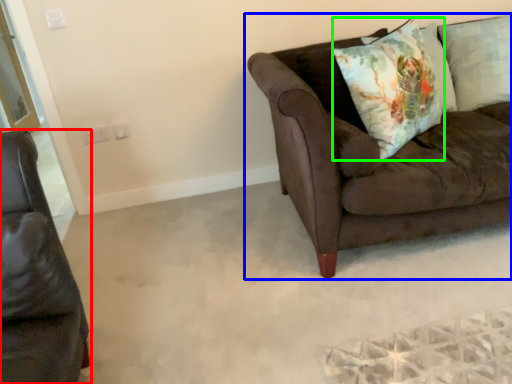
Question: Estimate the real-world distances between objects in this image. Which object is closer to studio couch (highlighted by a red box), studio couch (highlighted by a blue box) or throw pillow (highlighted by a green box)?

Choices:
 (A) studio couch
 (B) throw pillow

Answer: (A)